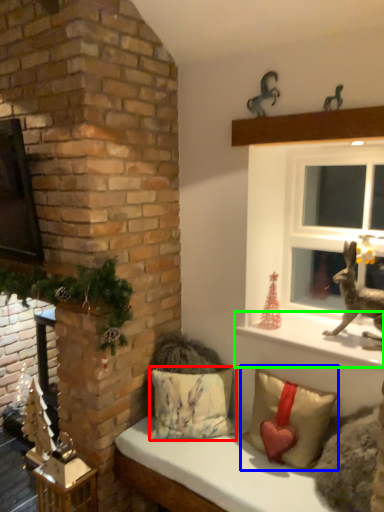
Question: Which object is the closest to the pillow (highlighted by a red box)? Choose among these: pillow (highlighted by a blue box) or window sill (highlighted by a green box).

Choices:
 (A) pillow
 (B) window sill

Answer: (A)